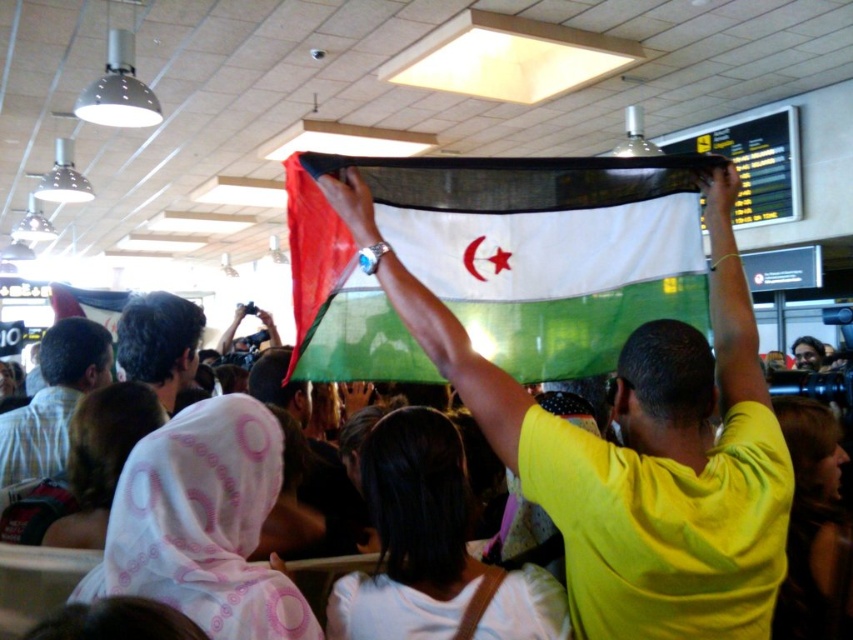
Question: Based on their relative distances, which object is farther from the dark brown hair at center?

Choices:
 (A) light brown shirt at center
 (B) yellow matte shirt at upper center
 (C) green fabric flag at center

Answer: (B)

Question: Can you confirm if yellow matte shirt at upper center is smaller than light brown shirt at center?

Choices:
 (A) no
 (B) yes

Answer: (A)

Question: From the image, what is the correct spatial relationship of yellow matte shirt at upper center in relation to dark brown hair at center?

Choices:
 (A) below
 (B) above

Answer: (A)

Question: Which of the following is the farthest from the observer?

Choices:
 (A) (627, 598)
 (B) (47, 413)
 (C) (154, 333)

Answer: (B)

Question: Is yellow matte shirt at upper center wider than green fabric flag at center?

Choices:
 (A) yes
 (B) no

Answer: (B)

Question: Which object is closer to the camera taking this photo?

Choices:
 (A) yellow matte shirt at upper center
 (B) dark brown hair at center
 (C) light brown shirt at center
 (D) green fabric flag at center

Answer: (A)